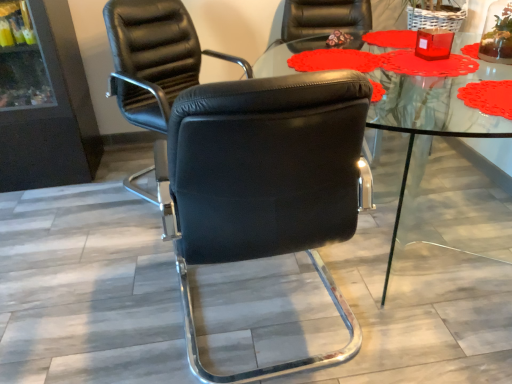
Question: Considering the relative sizes of transparent glass table at center and black leather chair at center, the 1th chair from the front, in the image provided, is transparent glass table at center smaller than black leather chair at center, the 1th chair from the front,?

Choices:
 (A) yes
 (B) no

Answer: (B)

Question: Does transparent glass table at center appear on the right side of black leather chair at center, the 1th chair from the front?

Choices:
 (A) yes
 (B) no

Answer: (A)

Question: Can you confirm if transparent glass table at center is wider than black leather chair at center, the second chair when ordered from back to front?

Choices:
 (A) yes
 (B) no

Answer: (A)

Question: Considering the relative positions of transparent glass table at center and black leather chair at center, the second chair when ordered from back to front, in the image provided, is transparent glass table at center to the left of black leather chair at center, the second chair when ordered from back to front, from the viewer's perspective?

Choices:
 (A) no
 (B) yes

Answer: (A)

Question: From a real-world perspective, is transparent glass table at center on top of black leather chair at center, the 1th chair from the front?

Choices:
 (A) no
 (B) yes

Answer: (A)

Question: From the image's perspective, does transparent glass table at center appear higher than black leather chair at center, the 1th chair from the front?

Choices:
 (A) no
 (B) yes

Answer: (B)

Question: Considering the relative positions of black leather chair at center, the 1th chair from the front, and black leather chair at center, acting as the 1th chair starting from the back, in the image provided, is black leather chair at center, the 1th chair from the front, behind black leather chair at center, acting as the 1th chair starting from the back,?

Choices:
 (A) no
 (B) yes

Answer: (A)

Question: From a real-world perspective, is black leather chair at center, the 1th chair from the front, physically below black leather chair at center, acting as the 1th chair starting from the back?

Choices:
 (A) no
 (B) yes

Answer: (B)

Question: Can you confirm if black leather chair at center, the second chair when ordered from back to front, is wider than black leather chair at center, acting as the 1th chair starting from the back?

Choices:
 (A) no
 (B) yes

Answer: (B)

Question: Does black leather chair at center, the second chair when ordered from back to front, have a lesser width compared to black leather chair at center, which ranks as the 2th chair in front-to-back order?

Choices:
 (A) yes
 (B) no

Answer: (B)

Question: Is black leather chair at center, the 1th chair from the front, completely or partially outside of black leather chair at center, acting as the 1th chair starting from the back?

Choices:
 (A) no
 (B) yes

Answer: (B)

Question: Is black leather chair at center, the 1th chair from the front, directly adjacent to black leather chair at center, which ranks as the 2th chair in front-to-back order?

Choices:
 (A) no
 (B) yes

Answer: (A)

Question: From the image's perspective, is black leather chair at center, the second chair when ordered from back to front, under transparent glass table at center?

Choices:
 (A) yes
 (B) no

Answer: (A)